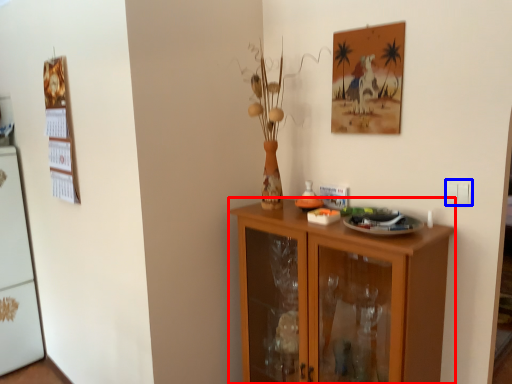
Question: Among these objects, which one is farthest to the camera, cabinetry (highlighted by a red box) or electric outlet (highlighted by a blue box)?

Choices:
 (A) cabinetry
 (B) electric outlet

Answer: (B)